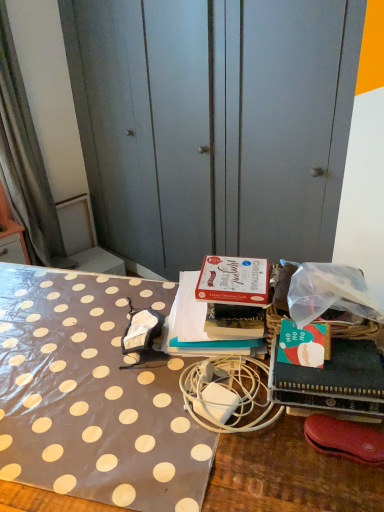
Question: Can you confirm if polka dot fabric at center is smaller than white matte charger at center?

Choices:
 (A) yes
 (B) no

Answer: (B)

Question: Is polka dot fabric at center touching white matte charger at center?

Choices:
 (A) no
 (B) yes

Answer: (A)

Question: Could white matte charger at center be considered to be inside polka dot fabric at center?

Choices:
 (A) no
 (B) yes

Answer: (A)

Question: Does polka dot fabric at center come behind white matte charger at center?

Choices:
 (A) no
 (B) yes

Answer: (A)

Question: Considering the relative sizes of polka dot fabric at center and white matte charger at center in the image provided, is polka dot fabric at center wider than white matte charger at center?

Choices:
 (A) yes
 (B) no

Answer: (A)

Question: Is polka dot fabric at center turned away from white matte charger at center?

Choices:
 (A) no
 (B) yes

Answer: (A)

Question: Can you confirm if matte cardboard box at center, placed as the 2th book when sorted from front to back, is wider than polka dot fabric at left?

Choices:
 (A) yes
 (B) no

Answer: (A)

Question: Is matte cardboard box at center, the 1th book in the back-to-front sequence, aimed at polka dot fabric at left?

Choices:
 (A) yes
 (B) no

Answer: (B)

Question: Does matte cardboard box at center, placed as the 2th book when sorted from front to back, have a smaller size compared to polka dot fabric at left?

Choices:
 (A) yes
 (B) no

Answer: (A)

Question: Is matte cardboard box at center, the 1th book in the back-to-front sequence, in front of polka dot fabric at left?

Choices:
 (A) no
 (B) yes

Answer: (B)

Question: From a real-world perspective, is matte cardboard box at center, the 1th book in the back-to-front sequence, positioned under polka dot fabric at left based on gravity?

Choices:
 (A) yes
 (B) no

Answer: (B)

Question: Is matte cardboard box at center, placed as the 2th book when sorted from front to back, bigger than polka dot fabric at left?

Choices:
 (A) yes
 (B) no

Answer: (B)

Question: Are white matte charger at center and polka dot fabric at center making contact?

Choices:
 (A) no
 (B) yes

Answer: (A)